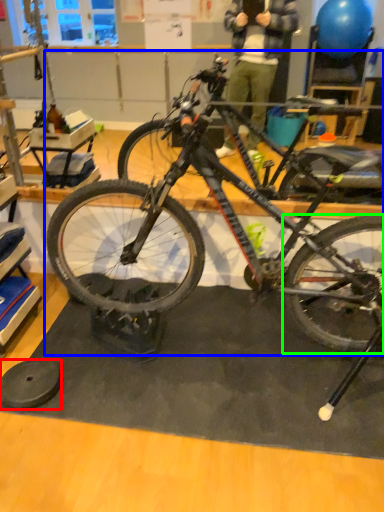
Question: Considering the real-world distances, which object is farthest from wheel (highlighted by a red box)? bicycle (highlighted by a blue box) or bicycle wheel (highlighted by a green box)?

Choices:
 (A) bicycle
 (B) bicycle wheel

Answer: (B)